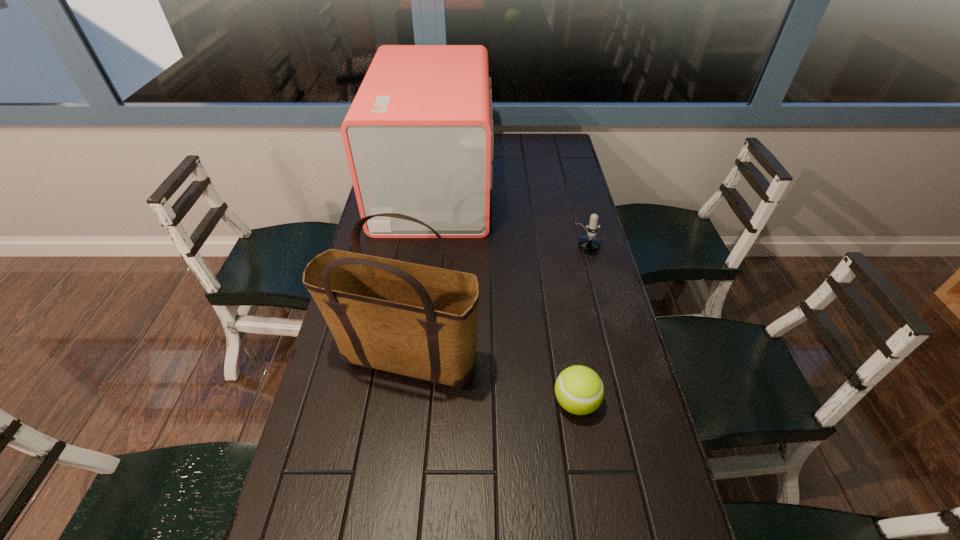
What are the coordinates of `box` in the screenshot? It's located at (418, 137).

Locate an element on the screen. Image resolution: width=960 pixels, height=540 pixels. tote bag is located at coordinates click(416, 320).

Identify the location of microphone. This screenshot has width=960, height=540. (589, 243).

Locate an element on the screen. The height and width of the screenshot is (540, 960). the third tallest object is located at coordinates (589, 243).

Locate an element on the screen. The width and height of the screenshot is (960, 540). tennis ball is located at coordinates (579, 390).

Where is `the shortest object`? Image resolution: width=960 pixels, height=540 pixels. the shortest object is located at coordinates (579, 390).

This screenshot has height=540, width=960. I want to click on free region located on the surface of the box where the text is embossed, so click(575, 187).

You are a GUI agent. You are given a task and a screenshot of the screen. Output one action in this format:
    pyautogui.click(x=<x>, y=<y>)
    Task: Click on the vacant space located 0.130m on the right of the tote bag
    
    Given the screenshot: What is the action you would take?
    pyautogui.click(x=532, y=360)

Identify the location of vacant region located 0.340m on the left of the rightmost object. (469, 239).

This screenshot has height=540, width=960. Find the location of `vacant space located on the front of the shortest object`. vacant space located on the front of the shortest object is located at coordinates (588, 470).